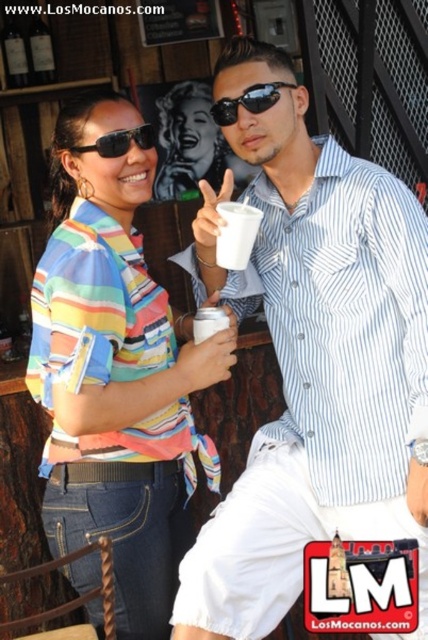
Does white matte cup at center appear over black matte sunglasses at upper left?

Incorrect, white matte cup at center is not positioned above black matte sunglasses at upper left.

Does point (225, 209) come in front of point (127, 132)?

Yes, it is.

Locate an element on the screen. white matte cup at center is located at coordinates (237, 234).

Is white matte cup at center to the right of white paper cup at center from the viewer's perspective?

Yes, white matte cup at center is to the right of white paper cup at center.

From the picture: Is white matte cup at center bigger than white paper cup at center?

Correct, white matte cup at center is larger in size than white paper cup at center.

In the scene shown: Measure the distance between white matte cup at center and camera.

white matte cup at center and camera are 1.62 meters apart from each other.

Image resolution: width=428 pixels, height=640 pixels. In order to click on white matte cup at center in this screenshot , I will do `click(237, 234)`.

Who is higher up, white striped shirt at center or black matte sunglasses at upper left?

black matte sunglasses at upper left is above.

Is white striped shirt at center wider than black matte sunglasses at upper left?

Indeed, white striped shirt at center has a greater width compared to black matte sunglasses at upper left.

Is point (371, 532) behind point (95, 147)?

Yes.

You are a GUI agent. You are given a task and a screenshot of the screen. Output one action in this format:
    pyautogui.click(x=<x>, y=<y>)
    Task: Click on the white striped shirt at center
    Image resolution: width=428 pixels, height=640 pixels.
    Given the screenshot: What is the action you would take?
    [x=315, y=372]